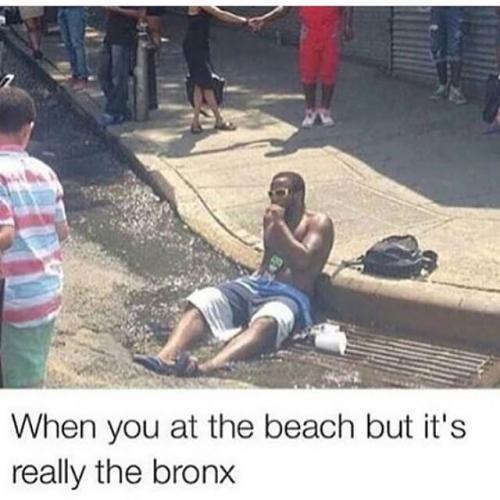
Identify the location of grate. (399, 347).